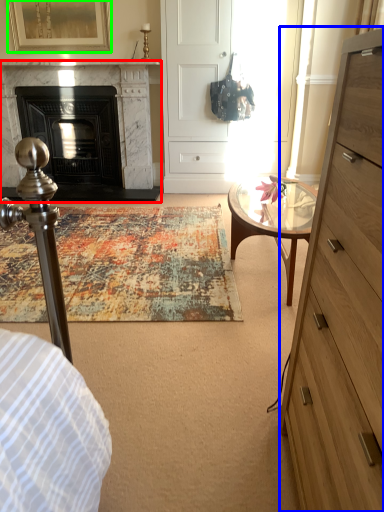
Question: Considering the real-world distances, which object is farthest from fireplace (highlighted by a red box)? chest of drawers (highlighted by a blue box) or picture frame (highlighted by a green box)?

Choices:
 (A) chest of drawers
 (B) picture frame

Answer: (A)